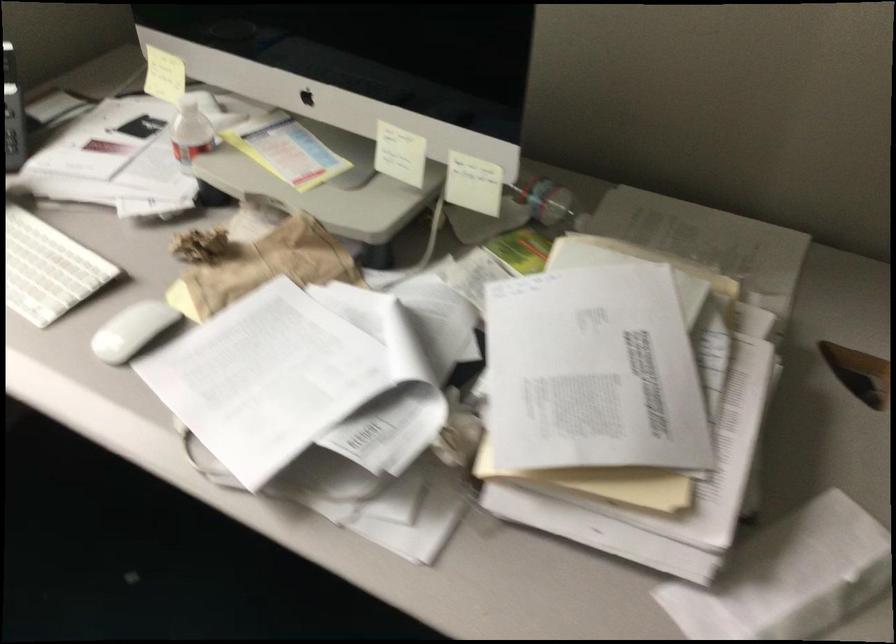
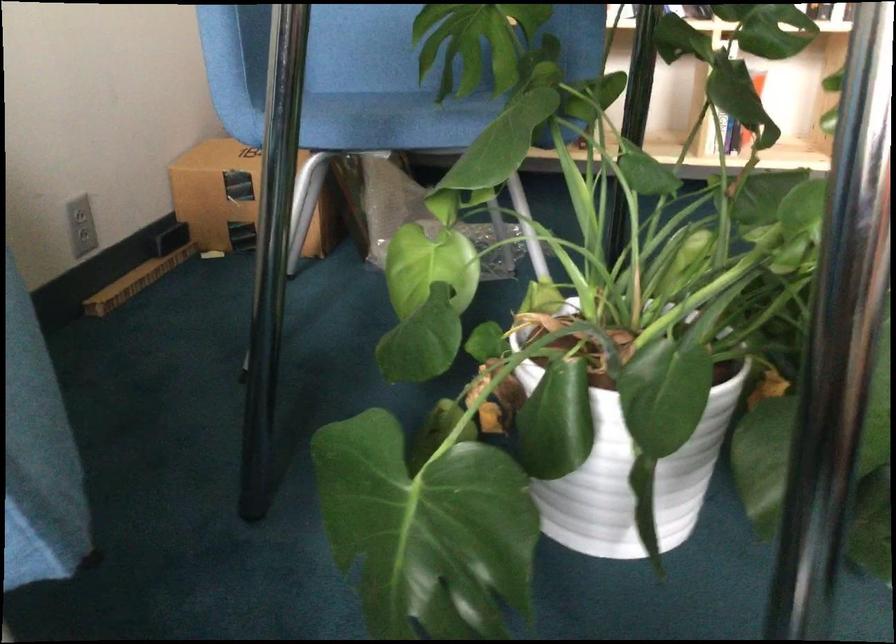
The images are taken continuously from a first-person perspective. In which direction is your viewpoint rotating?

The rotation direction of the camera is right-down.